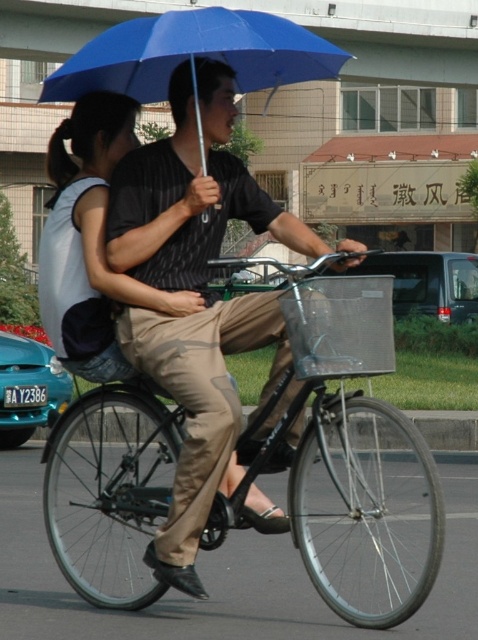
Locate an element on the screen. The image size is (478, 640). metallic silver bicycle at center is located at coordinates (345, 449).

Describe the element at coordinates (345, 449) in the screenshot. I see `metallic silver bicycle at center` at that location.

The width and height of the screenshot is (478, 640). What do you see at coordinates (345, 449) in the screenshot?
I see `metallic silver bicycle at center` at bounding box center [345, 449].

Find the location of `metallic silver bicycle at center`. metallic silver bicycle at center is located at coordinates (345, 449).

Is metallic silver bicycle at center below blue matte umbrella at upper center?

Yes.

Is point (88, 486) positioned behind point (152, 49)?

Yes, point (88, 486) is behind point (152, 49).

Find the location of a particular element. The height and width of the screenshot is (640, 478). metallic silver bicycle at center is located at coordinates (345, 449).

Between matte black shirt at center and blue matte umbrella at upper center, which one appears on the left side from the viewer's perspective?

From the viewer's perspective, blue matte umbrella at upper center appears more on the left side.

Locate an element on the screen. matte black shirt at center is located at coordinates (195, 291).

Find the location of a particular element. This screenshot has height=640, width=478. matte black shirt at center is located at coordinates (195, 291).